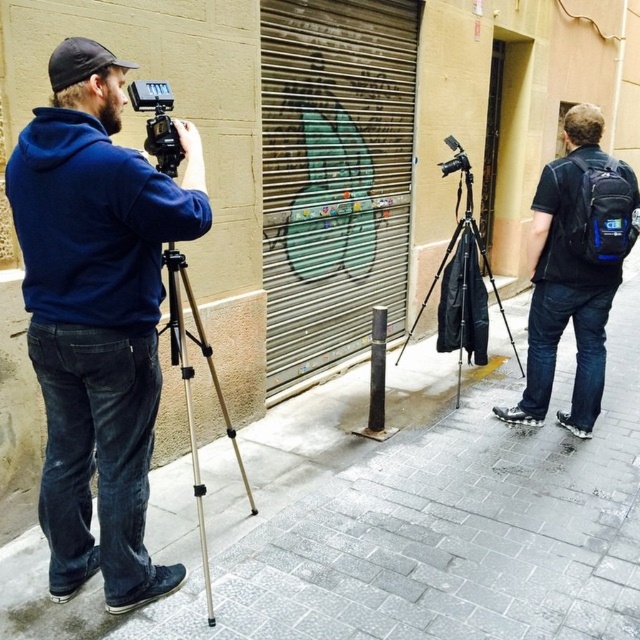
Question: Can you confirm if gray concrete pavement at center is thinner than matte blue hoodie at left?

Choices:
 (A) yes
 (B) no

Answer: (B)

Question: Estimate the real-world distances between objects in this image. Which object is farther from the blue fabric backpack at right?

Choices:
 (A) matte black camera at left
 (B) matte blue hoodie at left

Answer: (B)

Question: Does silver metallic tripod at left appear on the right side of black matte tripod at center?

Choices:
 (A) yes
 (B) no

Answer: (B)

Question: Does blue fabric backpack at right have a larger size compared to black matte tripod at center?

Choices:
 (A) yes
 (B) no

Answer: (A)

Question: Which of these objects is positioned farthest from the blue fabric backpack at right?

Choices:
 (A) matte blue hoodie at left
 (B) matte black tripod at center
 (C) black matte tripod at center
 (D) black matte pole at center

Answer: (A)

Question: Based on their relative distances, which object is farther from the black matte pole at center?

Choices:
 (A) matte black camera at left
 (B) gray concrete pavement at center

Answer: (A)